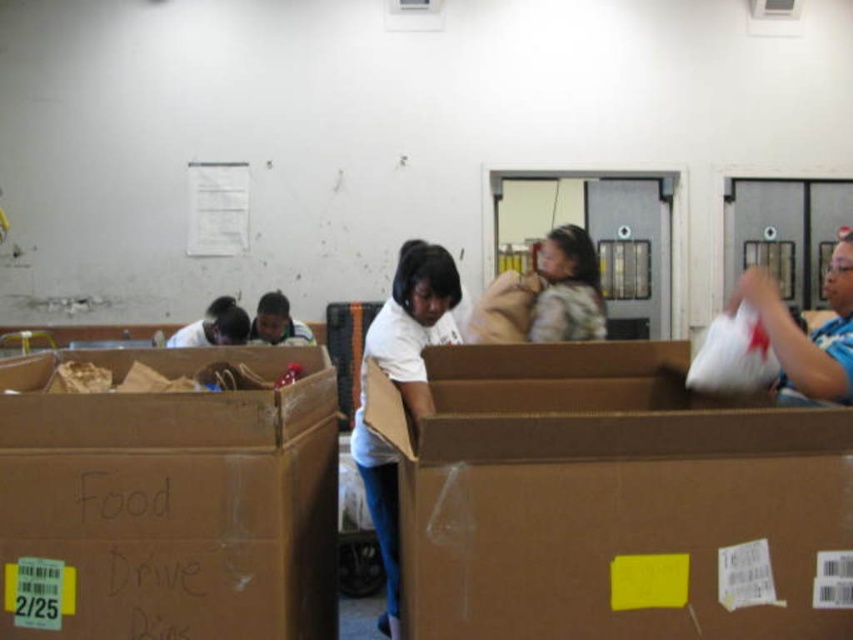
Question: Is the position of white matte shirt at center more distant than that of matte white shirt at center?

Choices:
 (A) no
 (B) yes

Answer: (A)

Question: Is brown cardboard box at center bigger than white matte shirt at center?

Choices:
 (A) yes
 (B) no

Answer: (A)

Question: Which point is closer to the camera?

Choices:
 (A) (369, 353)
 (B) (844, 524)

Answer: (B)

Question: Estimate the real-world distances between objects in this image. Which object is closer to the white matte shirt at center?

Choices:
 (A) brown cardboard box at center
 (B) matte white shirt at center

Answer: (A)

Question: Estimate the real-world distances between objects in this image. Which object is farther from the brown cardboard box at center?

Choices:
 (A) smooth black shirt at center
 (B) matte white shirt at center

Answer: (A)

Question: Does brown cardboard box at center appear over smooth black shirt at center?

Choices:
 (A) yes
 (B) no

Answer: (B)